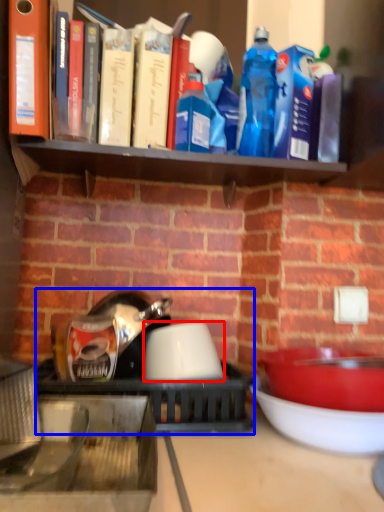
Question: Among these objects, which one is nearest to the camera, bowl (highlighted by a red box) or appliance (highlighted by a blue box)?

Choices:
 (A) bowl
 (B) appliance

Answer: (B)